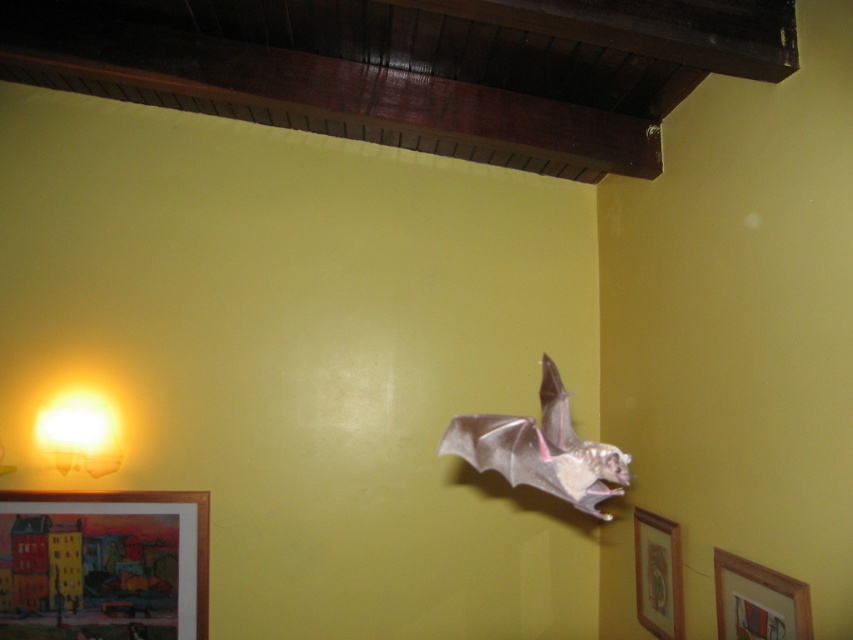
Question: Which object is the closest to the matte yellow glass lamp at lower left?

Choices:
 (A) wooden picture frame at upper right
 (B) wooden picture frame at lower right

Answer: (B)

Question: Is matte yellow glass lamp at lower left wider than wooden picture frame at lower right?

Choices:
 (A) yes
 (B) no

Answer: (A)

Question: Which point is closer to the camera?

Choices:
 (A) wooden picture frame at upper right
 (B) wooden framed painting at lower left

Answer: (A)

Question: Considering the relative positions of wooden framed painting at lower left and matte yellow glass lamp at lower left in the image provided, where is wooden framed painting at lower left located with respect to matte yellow glass lamp at lower left?

Choices:
 (A) left
 (B) right

Answer: (B)

Question: Estimate the real-world distances between objects in this image. Which object is farther from the wooden picture frame at lower right?

Choices:
 (A) wooden picture frame at upper right
 (B) wooden framed painting at lower left

Answer: (B)

Question: Is wooden picture frame at upper right thinner than matte yellow glass lamp at lower left?

Choices:
 (A) yes
 (B) no

Answer: (A)